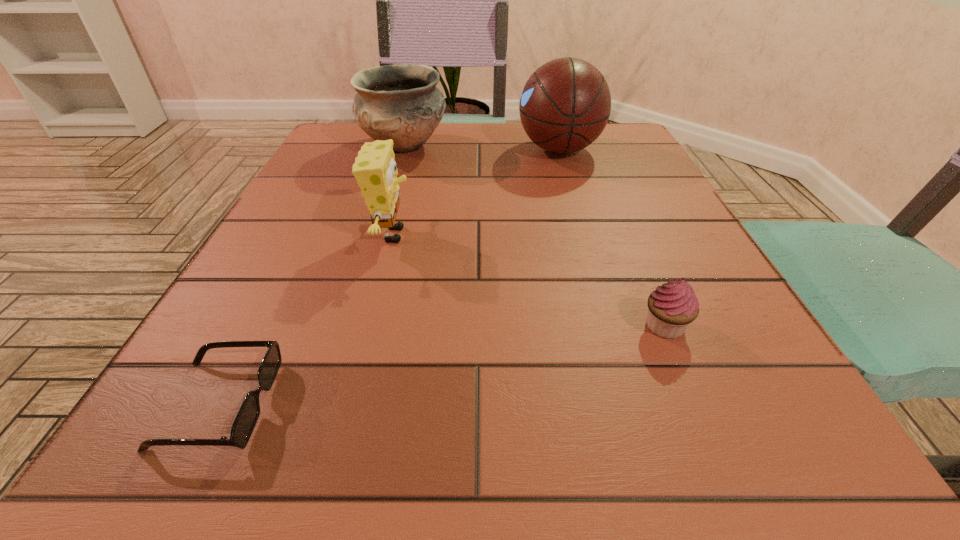
I want to click on basketball, so click(x=565, y=105).

What are the coordinates of `pottery` in the screenshot? It's located at (401, 102).

What are the coordinates of `the third nearest object` in the screenshot? It's located at (375, 170).

Where is `the second nearest object`? This screenshot has height=540, width=960. the second nearest object is located at coordinates (673, 306).

This screenshot has width=960, height=540. I want to click on the second shortest object, so click(673, 306).

Where is `the shortest object`? This screenshot has height=540, width=960. the shortest object is located at coordinates (247, 417).

You are a GUI agent. You are given a task and a screenshot of the screen. Output one action in this format:
    pyautogui.click(x=<x>, y=<y>)
    Task: Click on the nearest object
    This screenshot has width=960, height=540.
    Given the screenshot: What is the action you would take?
    pyautogui.click(x=247, y=417)

You are a GUI agent. You are given a task and a screenshot of the screen. Output one action in this format:
    pyautogui.click(x=<x>, y=<y>)
    Task: Click on the free space located on the front of the tallest object
    The width and height of the screenshot is (960, 540).
    Given the screenshot: What is the action you would take?
    pyautogui.click(x=574, y=196)

Image resolution: width=960 pixels, height=540 pixels. Find the location of `free space located 0.190m on the right of the pottery`. free space located 0.190m on the right of the pottery is located at coordinates (528, 146).

I want to click on vacant space located 0.280m on the face of the sponge, so click(573, 235).